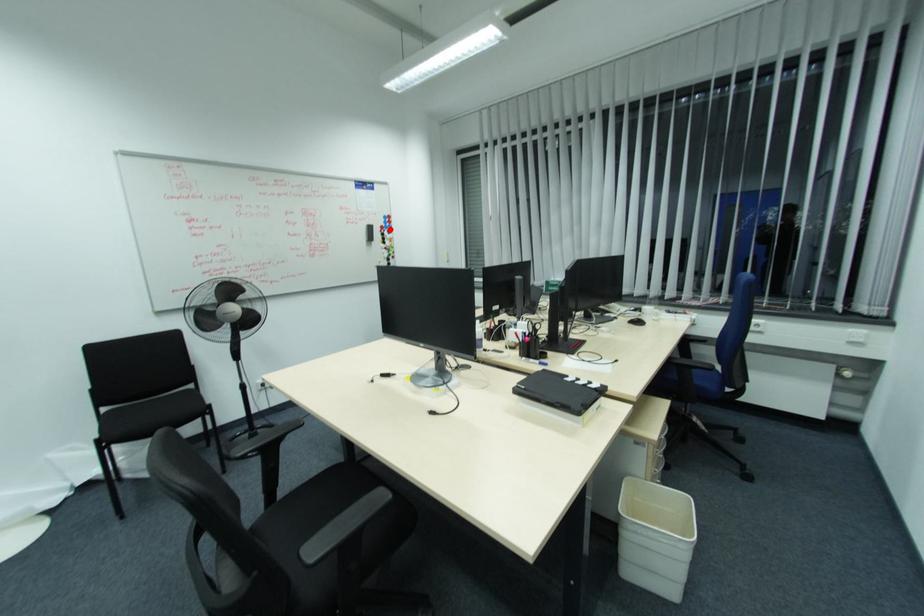
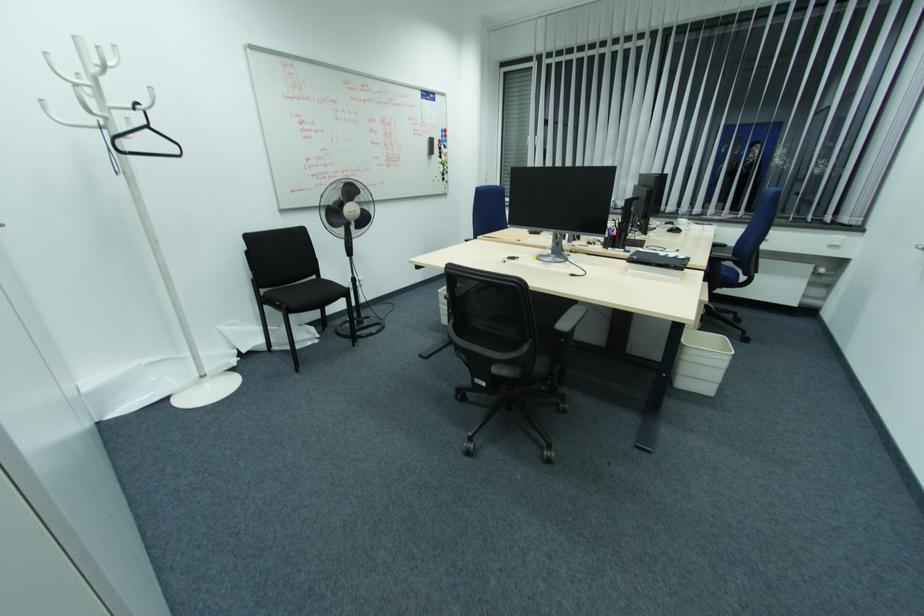
Where in the second image is the point corresponding to the highlighted location from the first image?

(445, 144)